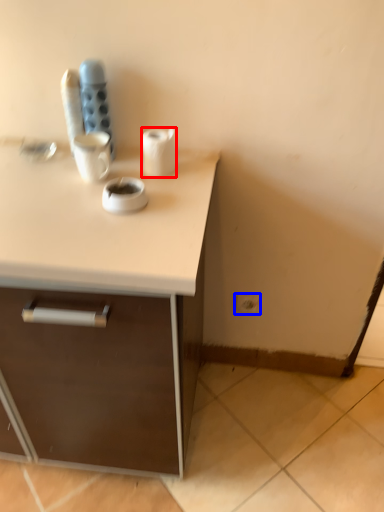
Question: Which of the following is the closest to the observer, paper towel (highlighted by a red box) or electric outlet (highlighted by a blue box)?

Choices:
 (A) paper towel
 (B) electric outlet

Answer: (A)